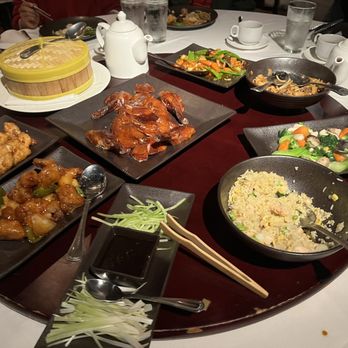
Where is `chop stick`? chop stick is located at coordinates (191, 262).